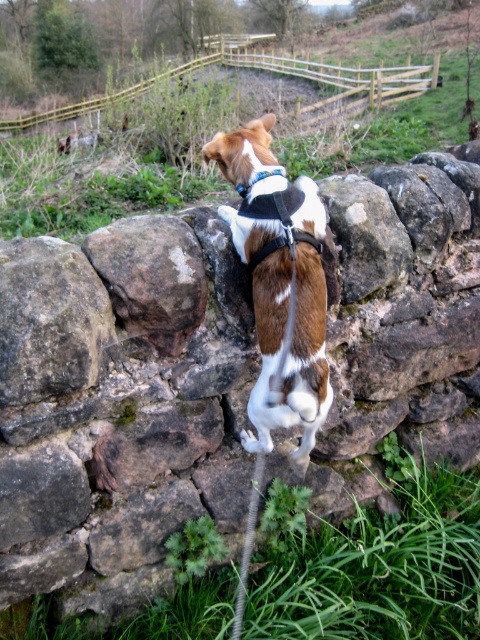
Question: From the image, what is the correct spatial relationship of brown rough stone at center in relation to blue fabric neckband at upper center?

Choices:
 (A) below
 (B) above

Answer: (A)

Question: Is brown and white fur at upper center closer to camera compared to blue fabric neckband at upper center?

Choices:
 (A) yes
 (B) no

Answer: (A)

Question: Is brown rough stone at center to the left of blue fabric neckband at upper center from the viewer's perspective?

Choices:
 (A) yes
 (B) no

Answer: (A)

Question: Which object appears farthest from the camera in this image?

Choices:
 (A) brown rough stone at center
 (B) blue fabric neckband at upper center

Answer: (B)

Question: Which point is farther to the camera?

Choices:
 (A) brown rough stone at center
 (B) blue fabric neckband at upper center
 (C) brown and white fur at upper center

Answer: (B)

Question: Which is nearer to the brown rough stone at center?

Choices:
 (A) blue fabric neckband at upper center
 (B) brown and white fur at upper center

Answer: (B)